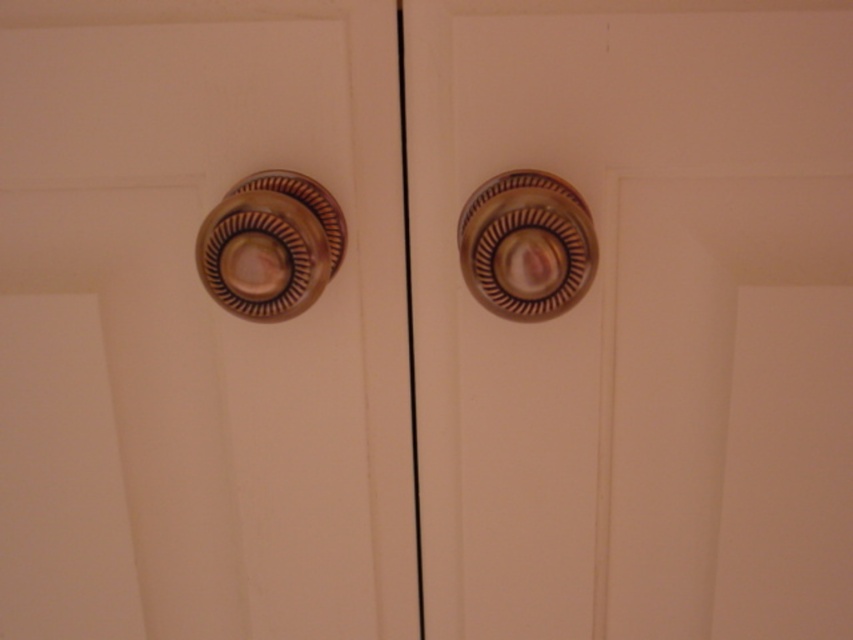
You are an interior designer planning to hang a small decorative hook exactly 10 cm above the metallic knob at center. Given the coordinates provided, can you determine the new coordinates for the hook?

The metallic knob at center is located at coordinates (639, 321). To place the hook 10 cm above it, the new coordinates would be (554, 321).

Looking at this image, you are designing a kitchen layout and need to ensure that the cabinet knobs are spaced appropriately. Given that you have two knobs, the metallic brass knob at center and the brass textured knob at upper left, which one would you place higher on the cabinet door to maintain visual balance?

The metallic brass knob at center has a greater height compared to the brass textured knob at upper left, so placing it higher on the cabinet door would help maintain visual balance by aligning the taller knob with the central axis of the door.

You are an interior designer assessing the placement of the brass textured knob at upper left on the cabinet door. What are the coordinates of this knob?

The brass textured knob at upper left is located at coordinates point (270, 244).